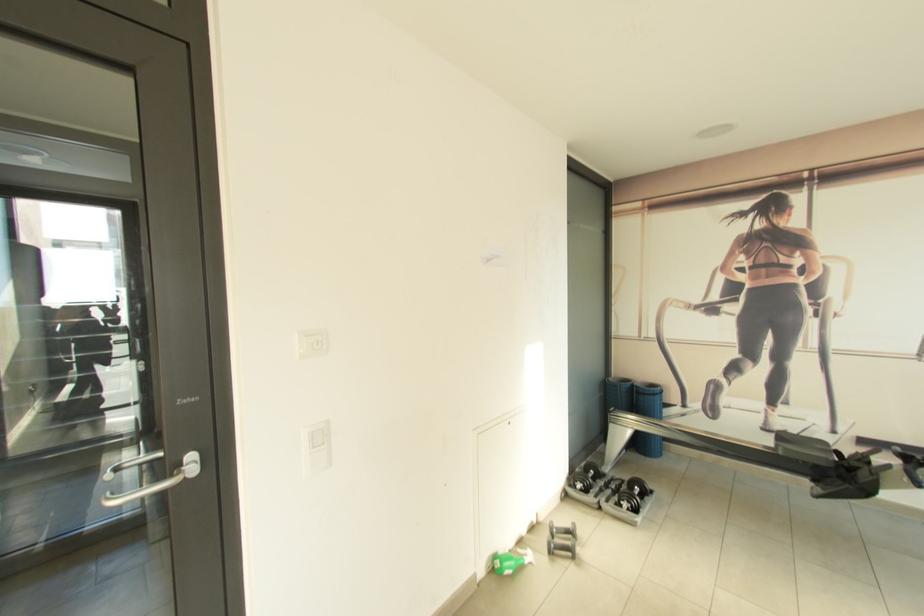
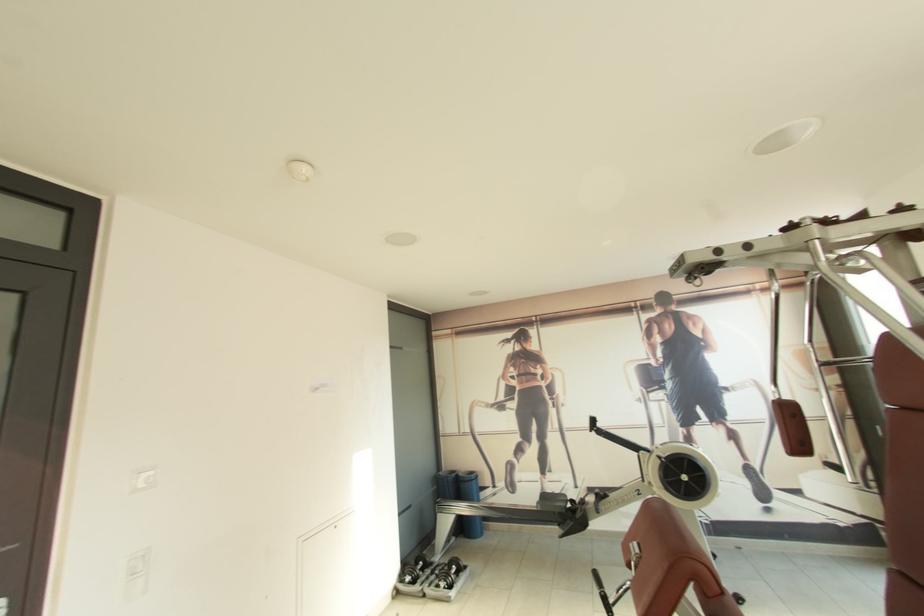
Locate, in the second image, the point that corresponds to the point at 592,483 in the first image.

(419, 575)